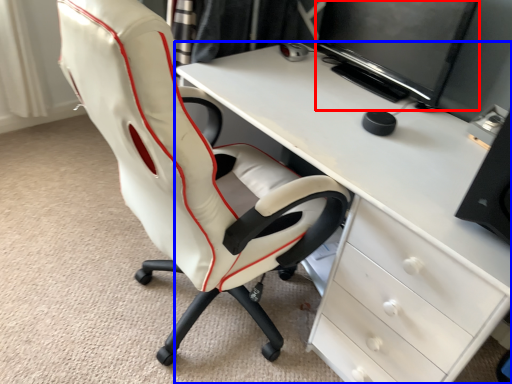
Question: Which point is further to the camera, computer monitor (highlighted by a red box) or desk (highlighted by a blue box)?

Choices:
 (A) computer monitor
 (B) desk

Answer: (A)